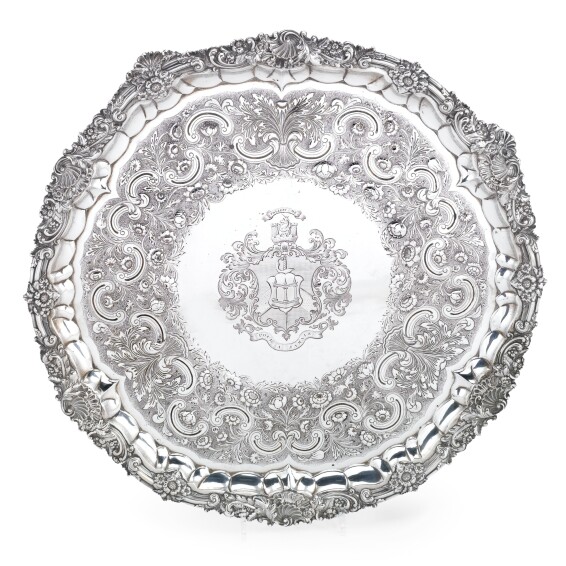
Locate an element on the screen. Image resolution: width=566 pixels, height=566 pixels. vase with leaves in it or feathers is located at coordinates (282, 128).